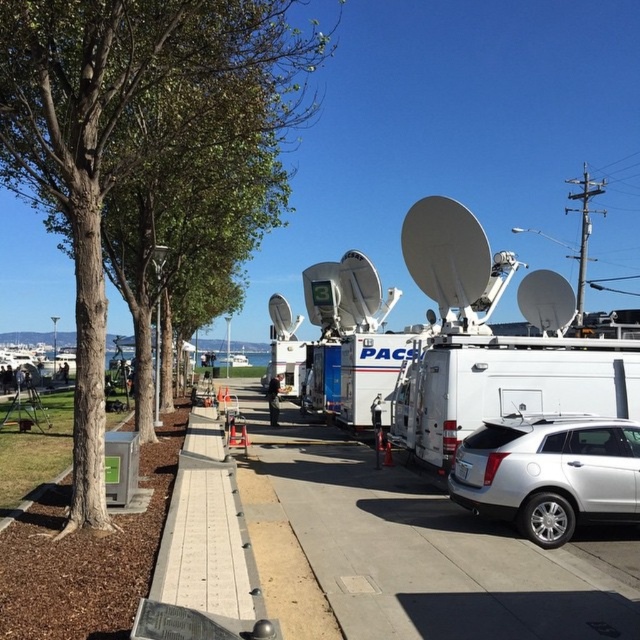
Question: Does green leafy tree at center have a lesser width compared to silver metallic suv at lower right?

Choices:
 (A) no
 (B) yes

Answer: (A)

Question: Can you confirm if green leafy tree at center is positioned below gray concrete sidewalk at center?

Choices:
 (A) no
 (B) yes

Answer: (A)

Question: Which is farther from the gray concrete sidewalk at center?

Choices:
 (A) silver metallic suv at lower right
 (B) green leafy tree at center

Answer: (B)

Question: Among these objects, which one is farthest from the camera?

Choices:
 (A) green leafy tree at center
 (B) silver metallic suv at lower right

Answer: (B)

Question: Based on their relative distances, which object is nearer to the green leafy tree at center?

Choices:
 (A) silver metallic suv at lower right
 (B) gray concrete sidewalk at center

Answer: (A)

Question: Where is green leafy tree at center located in relation to gray concrete sidewalk at center in the image?

Choices:
 (A) left
 (B) right

Answer: (A)